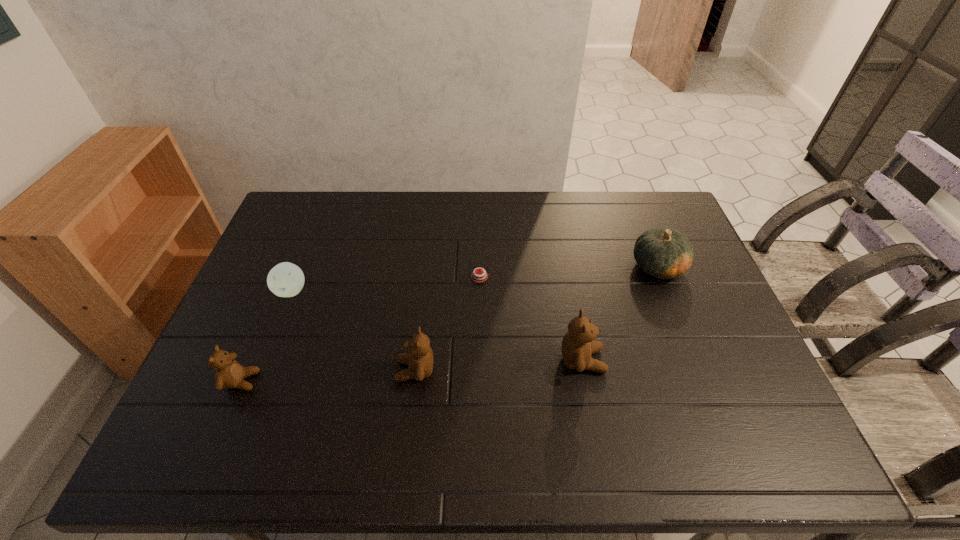
At what (x,y) coordinates should I click in order to perform the action: click on vacant area situated on the front-facing side of the third object from left to right. Please return your answer as a coordinate pair (x, y). The height and width of the screenshot is (540, 960). Looking at the image, I should click on (262, 370).

Where is `free location located 0.060m on the front-facing side of the third object from left to right`? free location located 0.060m on the front-facing side of the third object from left to right is located at coordinates (372, 370).

You are a GUI agent. You are given a task and a screenshot of the screen. Output one action in this format:
    pyautogui.click(x=<x>, y=<y>)
    Task: Click on the vacant space situated 0.230m on the front-facing side of the rightmost teddy bear
    The width and height of the screenshot is (960, 540).
    Given the screenshot: What is the action you would take?
    pyautogui.click(x=693, y=360)

Find the location of a particular element. vacant space located 0.160m on the front of the fifth tallest object is located at coordinates (269, 348).

Identify the location of free spot located on the front of the fourth object from left to right. (479, 343).

At what (x,y) coordinates should I click in order to perform the action: click on vacant space located on the front of the gourd. Please return your answer as a coordinate pair (x, y). Looking at the image, I should click on (704, 381).

The image size is (960, 540). I want to click on teddy bear present at the left edge, so click(229, 373).

Find the location of a particular element. Image resolution: width=960 pixels, height=540 pixels. apple situated at the left edge is located at coordinates (286, 279).

Identify the location of object present at the right edge. (662, 252).

Identify the location of object that is at the near left corner. This screenshot has width=960, height=540. (229, 373).